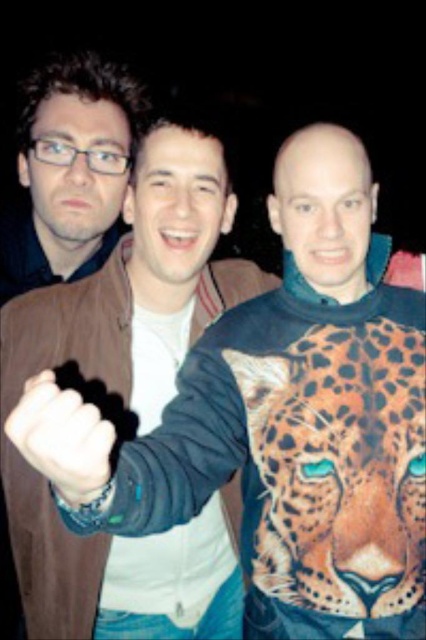
Question: Is orange printed leopard at center bigger than black leather glove at center?

Choices:
 (A) no
 (B) yes

Answer: (B)

Question: Does orange printed leopard at center come in front of black leather glove at center?

Choices:
 (A) yes
 (B) no

Answer: (B)

Question: Which object appears farthest from the camera in this image?

Choices:
 (A) orange printed leopard at center
 (B) black leather glove at center

Answer: (A)

Question: Which object is closer to the camera taking this photo?

Choices:
 (A) black leather glove at center
 (B) orange printed leopard at center

Answer: (A)

Question: Is orange printed leopard at center to the left of black leather glove at center from the viewer's perspective?

Choices:
 (A) no
 (B) yes

Answer: (A)